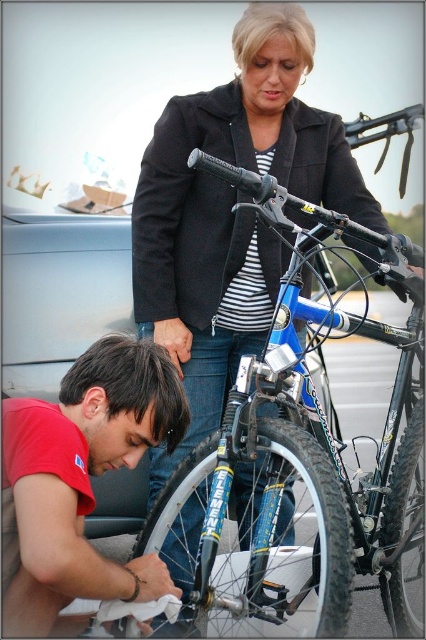
Is matte red shirt at lower left above blue rubber tire at lower center?

Yes, matte red shirt at lower left is above blue rubber tire at lower center.

From the picture: Is matte red shirt at lower left to the right of blue rubber tire at lower center from the viewer's perspective?

In fact, matte red shirt at lower left is to the left of blue rubber tire at lower center.

Identify the location of matte red shirt at lower left. click(80, 480).

Between point (259, 529) and point (379, 536), which one is positioned in front?

Positioned in front is point (259, 529).

Who is positioned more to the right, blue matte bicycle at center or black rubber tire at lower right?

From the viewer's perspective, black rubber tire at lower right appears more on the right side.

What do you see at coordinates (304, 444) in the screenshot?
I see `blue matte bicycle at center` at bounding box center [304, 444].

This screenshot has height=640, width=426. What are the coordinates of `blue matte bicycle at center` in the screenshot? It's located at (304, 444).

Image resolution: width=426 pixels, height=640 pixels. What do you see at coordinates (80, 480) in the screenshot?
I see `matte red shirt at lower left` at bounding box center [80, 480].

Who is more distant from viewer, (43, 499) or (423, 413)?

Positioned behind is point (423, 413).

This screenshot has width=426, height=640. I want to click on matte red shirt at lower left, so click(x=80, y=480).